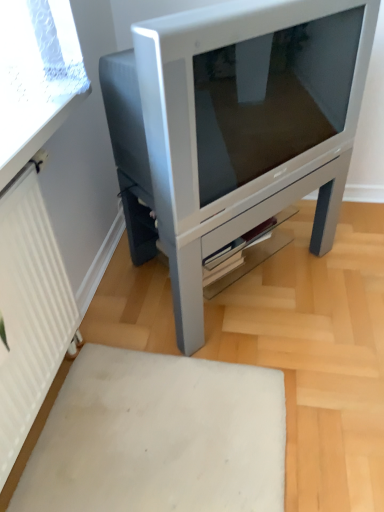
Question: Can we say satin silver television at center lies outside white matte rug at lower center?

Choices:
 (A) no
 (B) yes

Answer: (B)

Question: Is satin silver television at center oriented towards white matte rug at lower center?

Choices:
 (A) no
 (B) yes

Answer: (A)

Question: From a real-world perspective, is satin silver television at center on white matte rug at lower center?

Choices:
 (A) no
 (B) yes

Answer: (B)

Question: From the image's perspective, is satin silver television at center located beneath white matte rug at lower center?

Choices:
 (A) no
 (B) yes

Answer: (A)

Question: Is satin silver television at center oriented away from white matte rug at lower center?

Choices:
 (A) no
 (B) yes

Answer: (A)

Question: From a real-world perspective, is satin silver television at center under white matte rug at lower center?

Choices:
 (A) no
 (B) yes

Answer: (A)

Question: Does white matte rug at lower center lie in front of satin silver television at center?

Choices:
 (A) no
 (B) yes

Answer: (B)

Question: From a real-world perspective, is white matte rug at lower center below satin silver television at center?

Choices:
 (A) no
 (B) yes

Answer: (B)

Question: Is white matte rug at lower center wider than satin silver television at center?

Choices:
 (A) no
 (B) yes

Answer: (B)

Question: Does white matte rug at lower center touch satin silver television at center?

Choices:
 (A) no
 (B) yes

Answer: (A)

Question: Is white matte rug at lower center aimed at satin silver television at center?

Choices:
 (A) no
 (B) yes

Answer: (A)

Question: Is white matte rug at lower center far from satin silver television at center?

Choices:
 (A) no
 (B) yes

Answer: (A)

Question: Can you confirm if white ribbed radiator at left is positioned to the left of white matte rug at lower center?

Choices:
 (A) yes
 (B) no

Answer: (A)